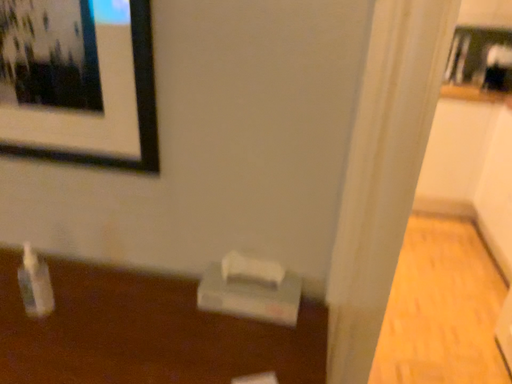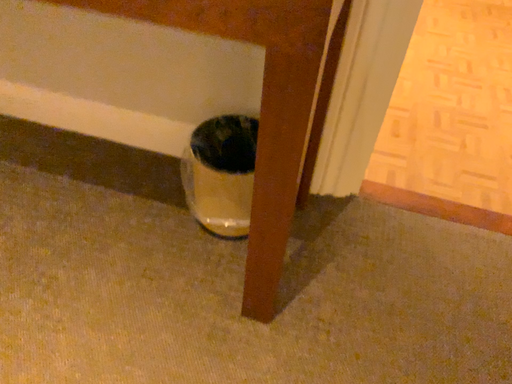
Question: How did the camera likely rotate when shooting the video?

Choices:
 (A) rotated upward
 (B) rotated downward

Answer: (B)